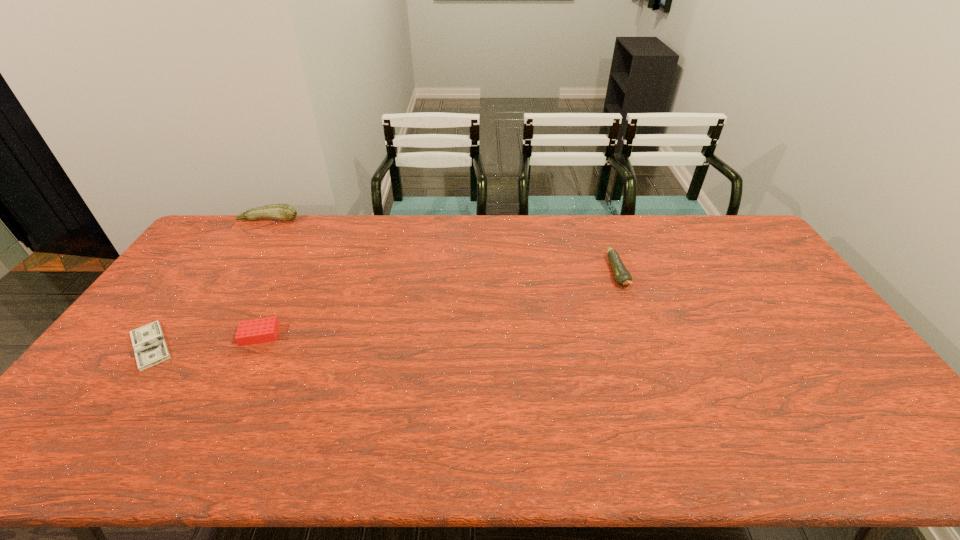
Locate an element on the screen. empty space that is in between the third shortest object and the third object from left to right is located at coordinates (439, 305).

This screenshot has height=540, width=960. What are the coordinates of `vacant area that lies between the farthest object and the shortest object` in the screenshot? It's located at (209, 282).

What are the coordinates of `free space between the second object from right to left and the nearer zucchini` in the screenshot? It's located at (439, 305).

In order to click on empty location between the rightmost object and the tallest object in this screenshot , I will do `click(444, 247)`.

The image size is (960, 540). I want to click on empty space that is in between the Lego and the shortest object, so click(x=205, y=340).

You are a GUI agent. You are given a task and a screenshot of the screen. Output one action in this format:
    pyautogui.click(x=<x>, y=<y>)
    Task: Click on the empty space that is in between the rightmost object and the Lego
    This screenshot has width=960, height=540.
    Given the screenshot: What is the action you would take?
    pyautogui.click(x=439, y=305)

Find the location of a particular element. Image resolution: width=960 pixels, height=540 pixels. unoccupied position between the left zucchini and the third object from left to right is located at coordinates (264, 277).

Locate an element on the screen. The width and height of the screenshot is (960, 540). vacant area that lies between the dollar and the third tallest object is located at coordinates (205, 340).

This screenshot has height=540, width=960. I want to click on free space between the left zucchini and the Lego, so click(x=264, y=277).

Where is `free space that is in between the tallest object and the Lego`? The image size is (960, 540). free space that is in between the tallest object and the Lego is located at coordinates (264, 277).